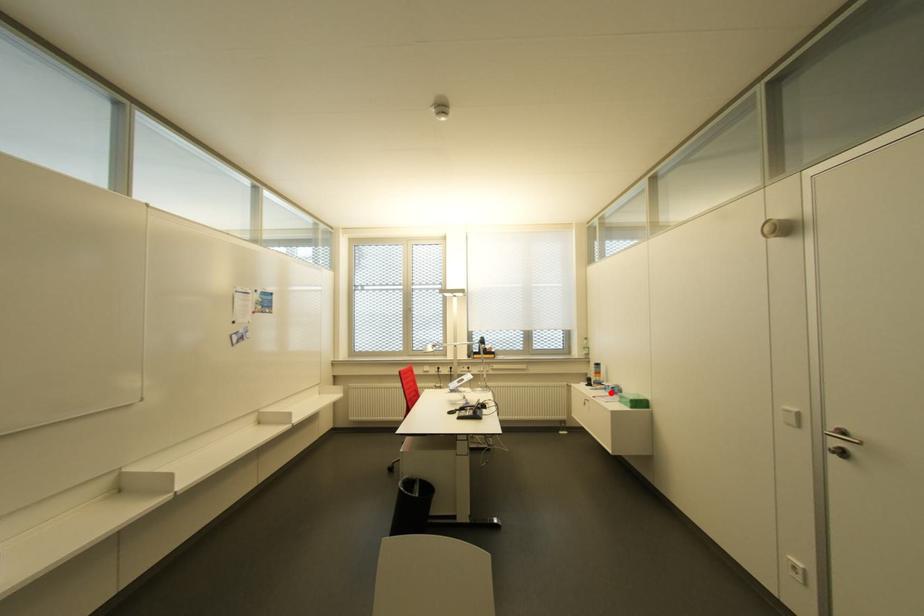
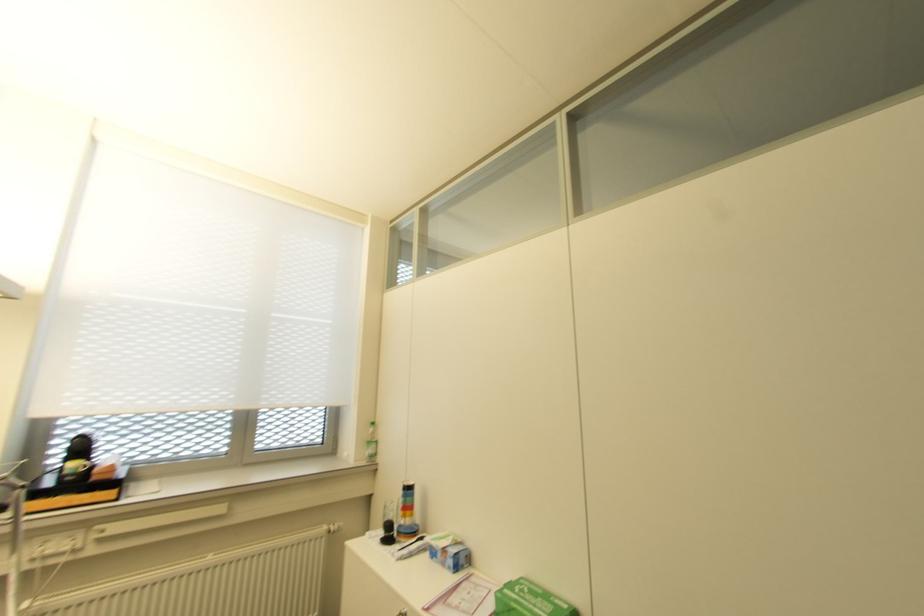
Where in the second image is the point corresponding to the highlighted location from the first image?

(454, 568)